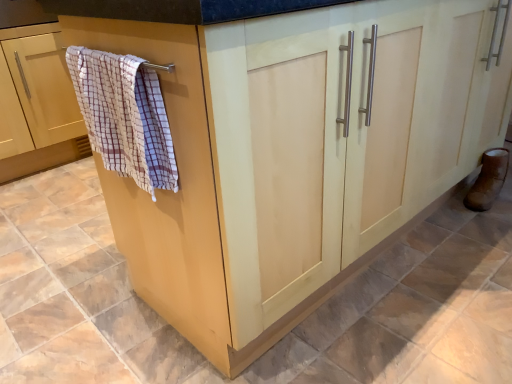
Question: Is point (492, 175) positioned closer to the camera than point (92, 72)?

Choices:
 (A) farther
 (B) closer

Answer: (A)

Question: From the image's perspective, is brown leather boot at lower right located above or below checkered fabric bath towel at left?

Choices:
 (A) below
 (B) above

Answer: (A)

Question: Which object is positioned farthest from the checkered fabric bath towel at left?

Choices:
 (A) beige wood towel rack at left
 (B) brown leather boot at lower right

Answer: (A)

Question: Which object is positioned farthest from the beige wood towel rack at left?

Choices:
 (A) checkered fabric bath towel at left
 (B) brown leather boot at lower right

Answer: (B)